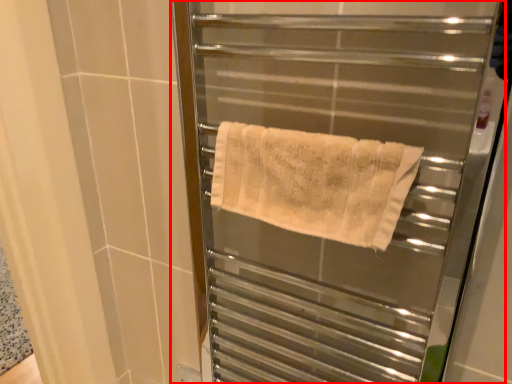
Question: From the image's perspective, considering the relative positions of screen door (annotated by the red box) and towel in the image provided, where is screen door (annotated by the red box) located with respect to the staircase?

Choices:
 (A) below
 (B) above

Answer: (A)